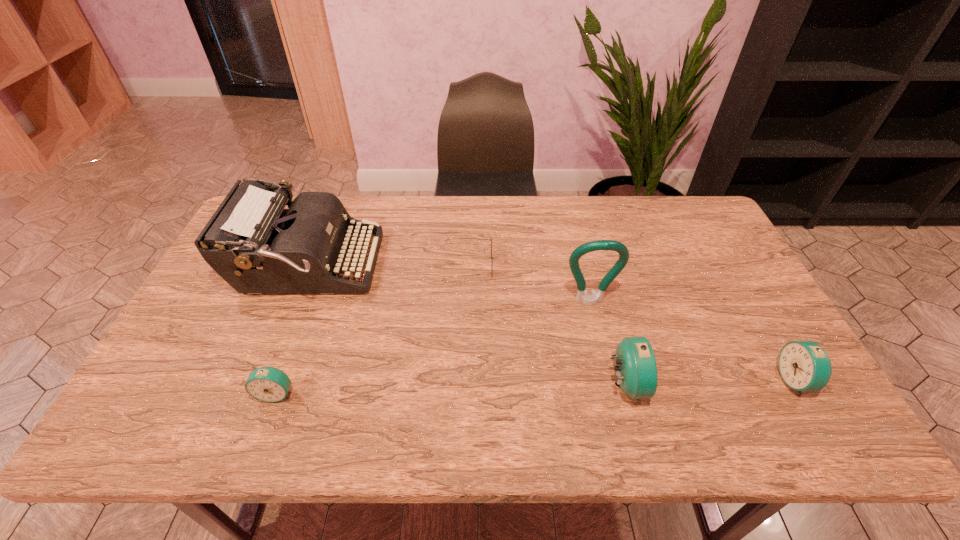
The height and width of the screenshot is (540, 960). What are the coordinates of `alarm clock that is the closest to the bottle opener` in the screenshot? It's located at (636, 370).

I want to click on the closest alarm clock to the typewriter, so click(268, 384).